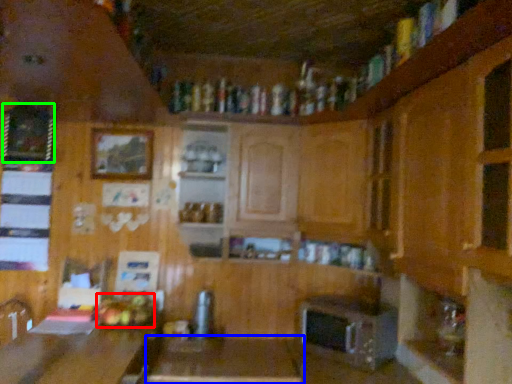
Question: Estimate the real-world distances between objects in this image. Which object is farther from food (highlighted by a red box), table (highlighted by a blue box) or picture frame (highlighted by a green box)?

Choices:
 (A) table
 (B) picture frame

Answer: (B)